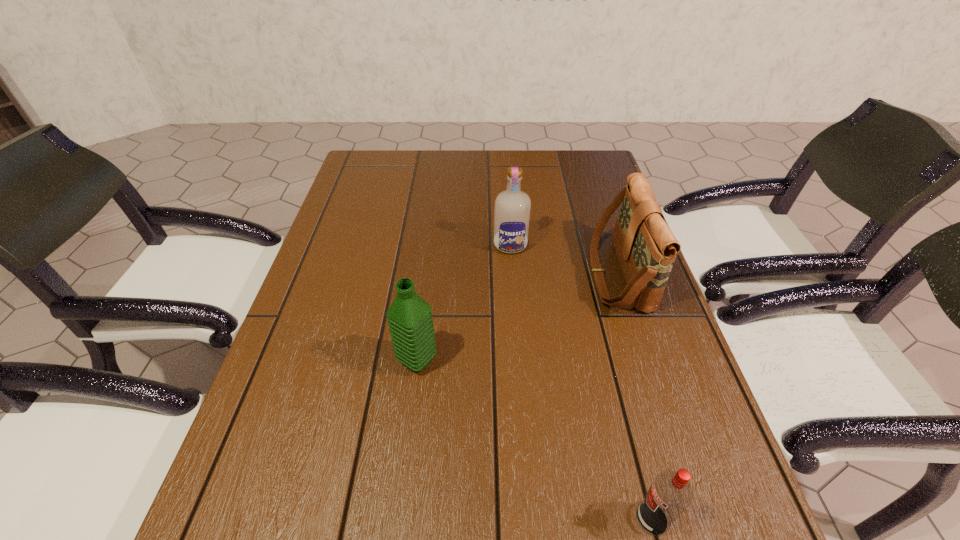
What are the coordinates of `free space between the farther vodka and the shoulder bag` in the screenshot? It's located at (564, 260).

This screenshot has height=540, width=960. Identify the location of free space between the farther vodka and the nearest object. (581, 382).

The height and width of the screenshot is (540, 960). In order to click on blank region between the water bottle and the farther vodka in this screenshot , I will do click(x=464, y=303).

Where is `object that is the third closest to the shortest object`? The width and height of the screenshot is (960, 540). object that is the third closest to the shortest object is located at coordinates (512, 208).

This screenshot has width=960, height=540. Identify the location of object that is the third nearest to the shortest object. (512, 208).